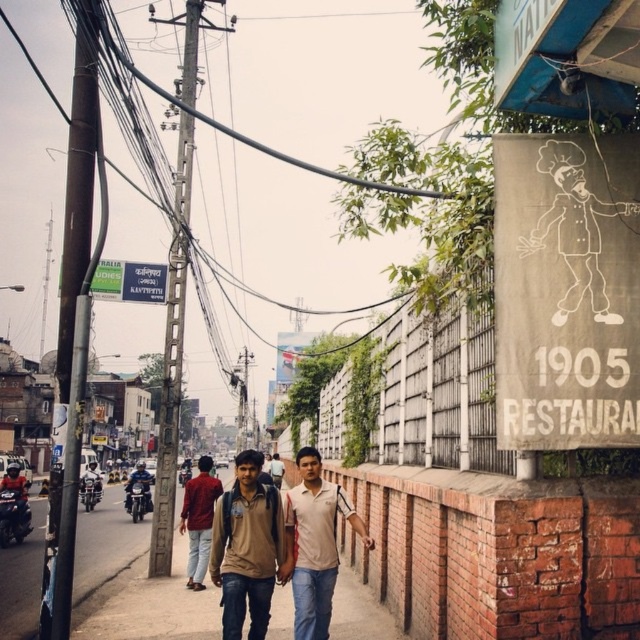
Question: Which point appears closest to the camera in this image?

Choices:
 (A) (138, 288)
 (B) (353, 509)
 (C) (196, 506)
 (D) (218, 513)

Answer: (D)

Question: Observing the image, what is the correct spatial positioning of light beige cotton shirt at center in reference to blue plastic signboard at upper left?

Choices:
 (A) right
 (B) left

Answer: (A)

Question: Which object appears closest to the camera in this image?

Choices:
 (A) matte red shirt at center
 (B) shiny black motorcycle at left

Answer: (A)

Question: Considering the relative positions of shiny chrome motorcycle at center-left and light brown leather jacket at left in the image provided, where is shiny chrome motorcycle at center-left located with respect to light brown leather jacket at left?

Choices:
 (A) left
 (B) right

Answer: (B)

Question: Is matte red shirt at center positioned before shiny chrome motorcycle at center-left?

Choices:
 (A) no
 (B) yes

Answer: (B)

Question: Which of the following is the closest to the observer?

Choices:
 (A) shiny blue motorcycle at center-left
 (B) matte red shirt at center
 (C) blue plastic signboard at upper left
 (D) light beige cotton shirt at center

Answer: (D)